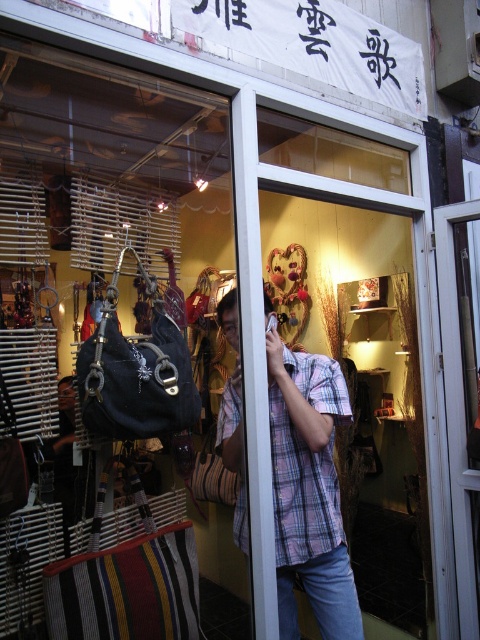
Which is above, plaid cotton shirt at center or transparent wood glass door at center?

transparent wood glass door at center is above.

Can you confirm if plaid cotton shirt at center is positioned below transparent wood glass door at center?

Indeed, plaid cotton shirt at center is positioned under transparent wood glass door at center.

Is point (337, 518) closer to camera compared to point (470, 560)?

Yes, point (337, 518) is in front of point (470, 560).

I want to click on plaid cotton shirt at center, so click(308, 488).